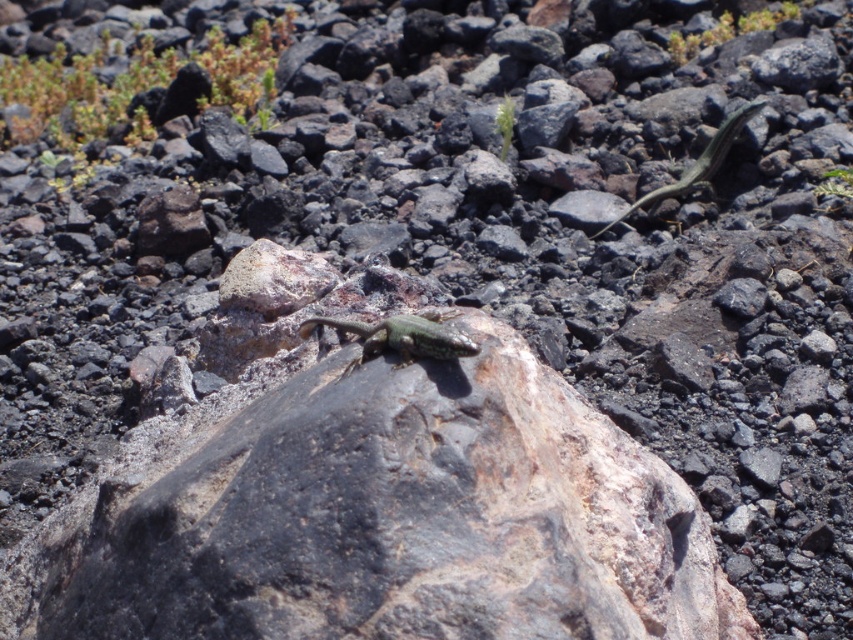
Can you confirm if green scaly lizard at center is positioned above green glossy lizard at upper right?

Incorrect, green scaly lizard at center is not positioned above green glossy lizard at upper right.

Is green scaly lizard at center closer to the viewer compared to green glossy lizard at upper right?

Yes, it is.

Is point (474, 353) positioned before point (715, 134)?

Yes, it is.

I want to click on green scaly lizard at center, so click(401, 337).